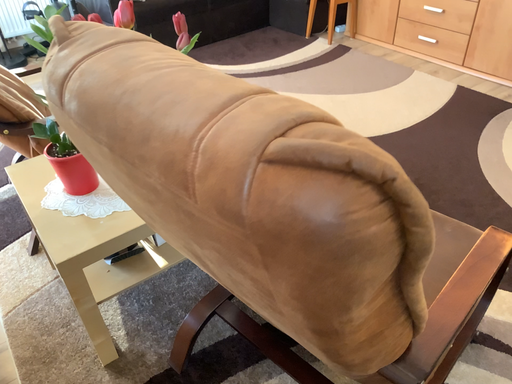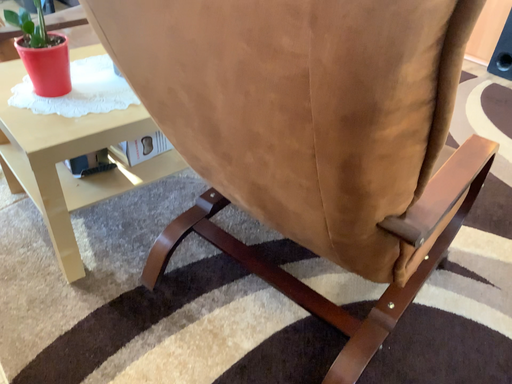
Question: How did the camera likely rotate when shooting the video?

Choices:
 (A) rotated right
 (B) rotated left

Answer: (A)